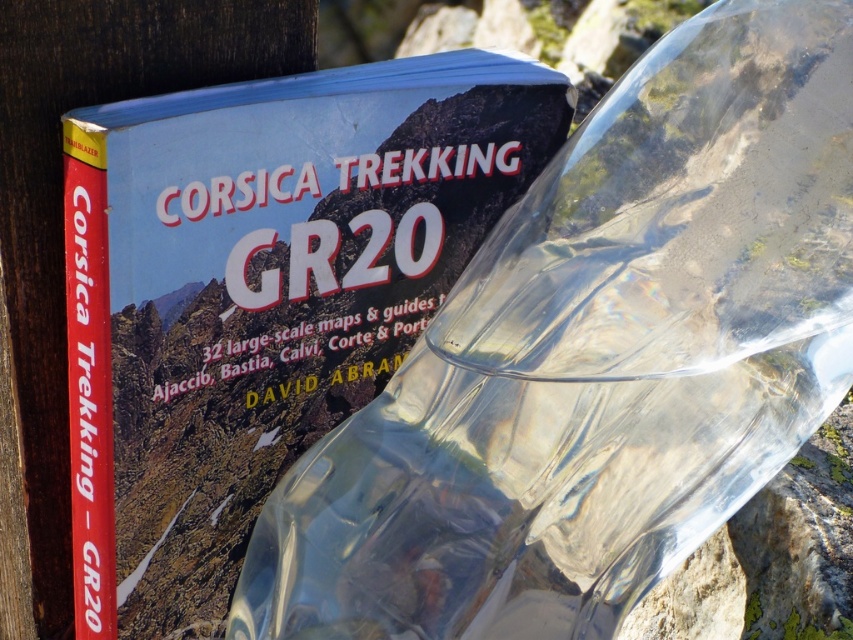
Locate an element on the screen. The height and width of the screenshot is (640, 853). transparent plastic bottle at center is located at coordinates coord(596,360).

How much distance is there between transparent plastic bottle at center and matte paper book at center?

A distance of 3.70 inches exists between transparent plastic bottle at center and matte paper book at center.

I want to click on transparent plastic bottle at center, so click(x=596, y=360).